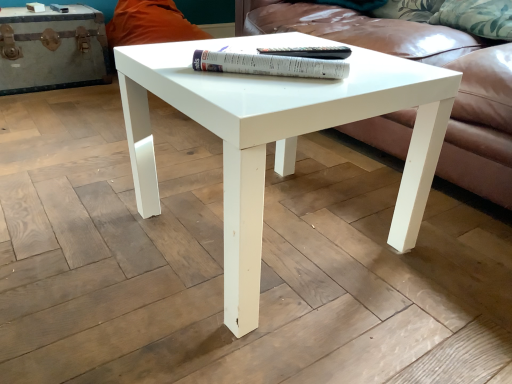
Locate an element on the screen. The height and width of the screenshot is (384, 512). free point in front of white paper at center, which ranks as the 1th paperback book in front-to-back order is located at coordinates (272, 88).